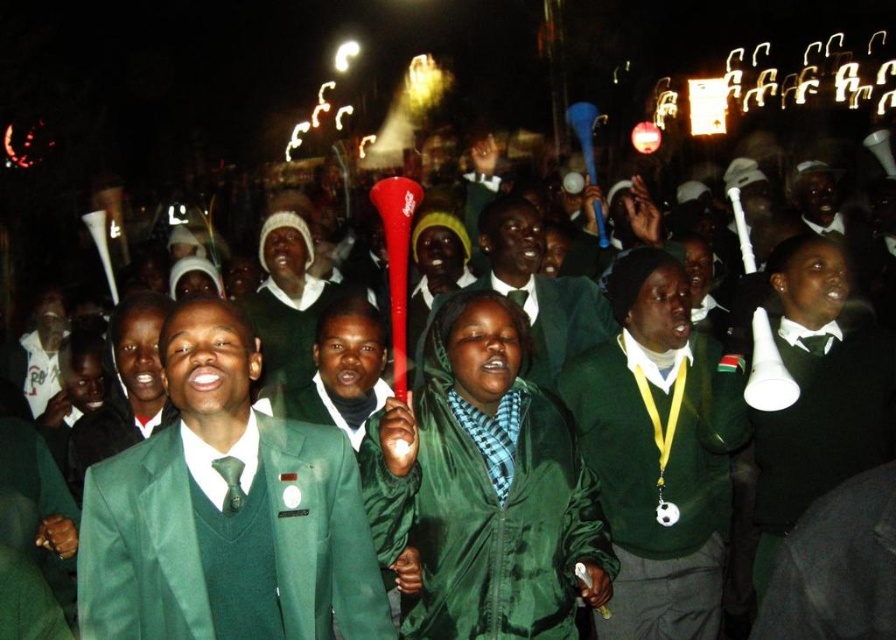
Is green fabric jacket at center smaller than green wool sweater at center?

Indeed, green fabric jacket at center has a smaller size compared to green wool sweater at center.

Image resolution: width=896 pixels, height=640 pixels. What do you see at coordinates (539, 289) in the screenshot?
I see `green fabric jacket at center` at bounding box center [539, 289].

This screenshot has height=640, width=896. Identify the location of green fabric jacket at center. (539, 289).

Does point (797, 323) come in front of point (490, 284)?

Yes, it is.

Is green fabric megaphone at center positioned before green fabric jacket at center?

Yes.

Which is in front, point (886, 390) or point (556, 332)?

Point (886, 390) is more forward.

Image resolution: width=896 pixels, height=640 pixels. I want to click on green fabric megaphone at center, so click(x=817, y=394).

Is green fabric suit at center smaller than green wool sweater at center?

Yes.

Which of these two, green fabric suit at center or green wool sweater at center, stands taller?

green wool sweater at center is taller.

Find the location of a particular element. green fabric suit at center is located at coordinates (226, 512).